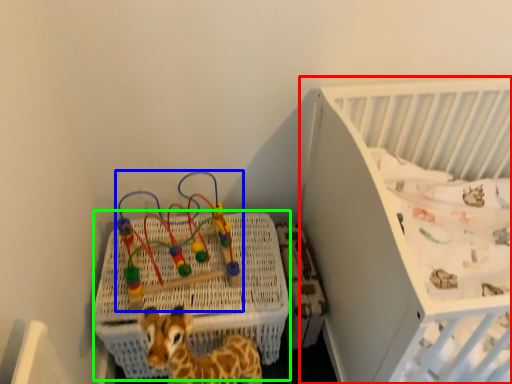
Question: Which object is the closest to the infant bed (highlighted by a red box)? Choose among these: toy (highlighted by a blue box) or crate (highlighted by a green box).

Choices:
 (A) toy
 (B) crate

Answer: (B)